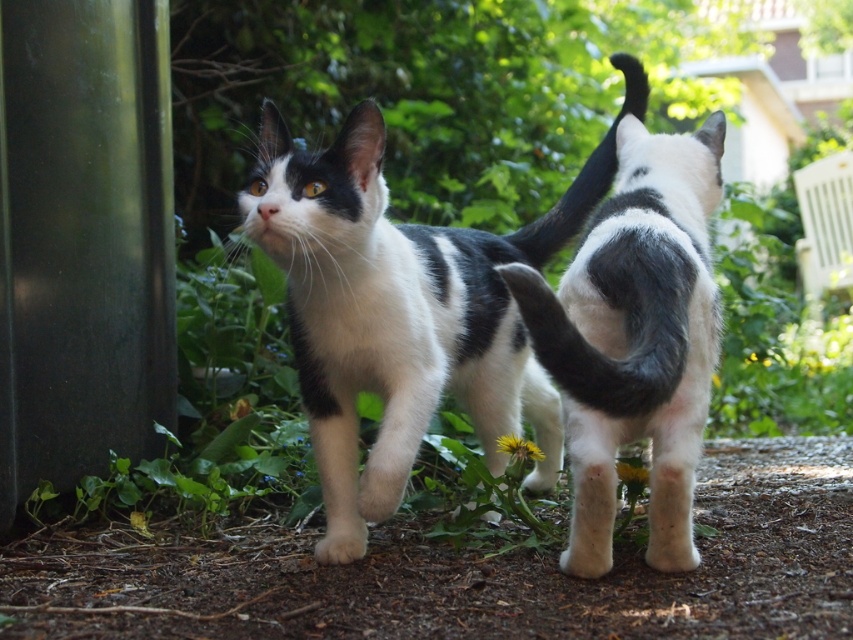
Is point (683, 548) positioned after point (602, 163)?

That is False.

Between black and white fur cat at center and black fur tail at upper center, which one has less height?

black fur tail at upper center is shorter.

Is point (706, 358) positioned before point (593, 180)?

Yes, it is.

Locate an element on the screen. This screenshot has height=640, width=853. black and white fur cat at center is located at coordinates (635, 337).

Looking at this image, can you confirm if black-and-white fur cat at center is positioned to the right of black soft fur tail at center?

In fact, black-and-white fur cat at center is to the left of black soft fur tail at center.

From the picture: Is black-and-white fur cat at center taller than black soft fur tail at center?

Yes.

Locate an element on the screen. black-and-white fur cat at center is located at coordinates [404, 310].

Does black-and-white fur cat at center have a greater height compared to black and white fur cat at center?

No, black-and-white fur cat at center is not taller than black and white fur cat at center.

Is black-and-white fur cat at center positioned before black and white fur cat at center?

No, black-and-white fur cat at center is behind black and white fur cat at center.

Locate an element on the screen. Image resolution: width=853 pixels, height=640 pixels. black-and-white fur cat at center is located at coordinates (404, 310).